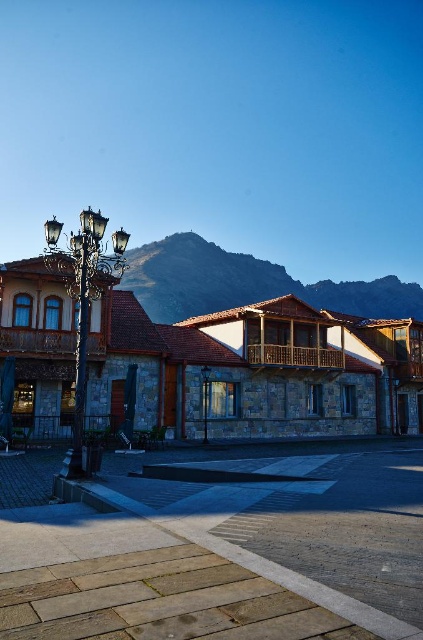
Is polished brass streetlamp at left to the left of polished brass lamp post at center from the viewer's perspective?

Indeed, polished brass streetlamp at left is positioned on the left side of polished brass lamp post at center.

In the scene shown: Who is more forward, (x=69, y=273) or (x=203, y=394)?

Point (x=69, y=273) is more forward.

Identify the location of polished brass streetlamp at left. The height and width of the screenshot is (640, 423). (84, 300).

Is polished brass streetlamp at left to the right of metallic streetlamp at left from the viewer's perspective?

No, polished brass streetlamp at left is not to the right of metallic streetlamp at left.

Locate an element on the screen. The image size is (423, 640). polished brass streetlamp at left is located at coordinates (84, 300).

Locate an element on the screen. The image size is (423, 640). polished brass streetlamp at left is located at coordinates (84, 300).

Is metallic streetlamp at left shorter than polished brass lamp post at center?

Yes.

Between point (76, 470) and point (205, 404), which one is positioned in front?

Point (76, 470) is in front.

This screenshot has width=423, height=640. Identify the location of metallic streetlamp at left. (79, 348).